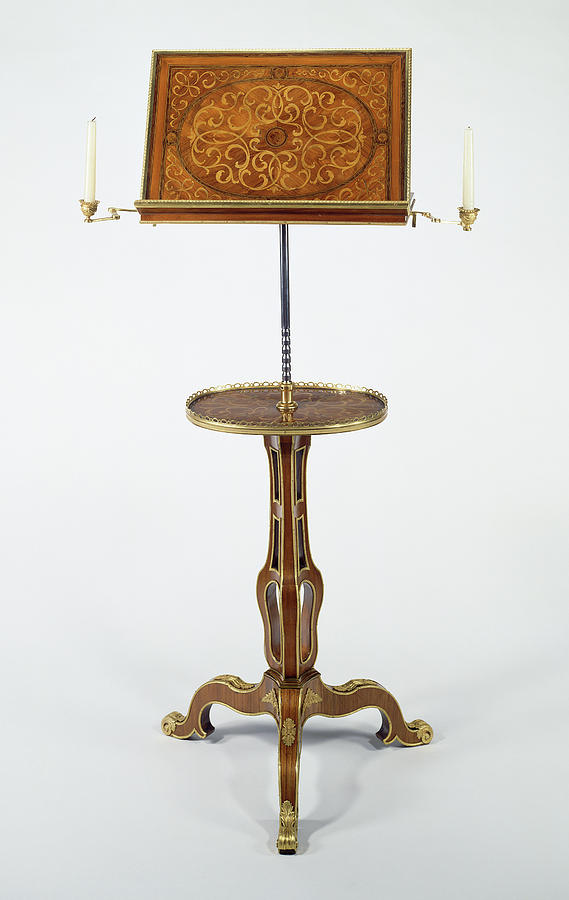
Where is `candleholders`? This screenshot has width=569, height=900. candleholders is located at coordinates (89, 213), (464, 216).